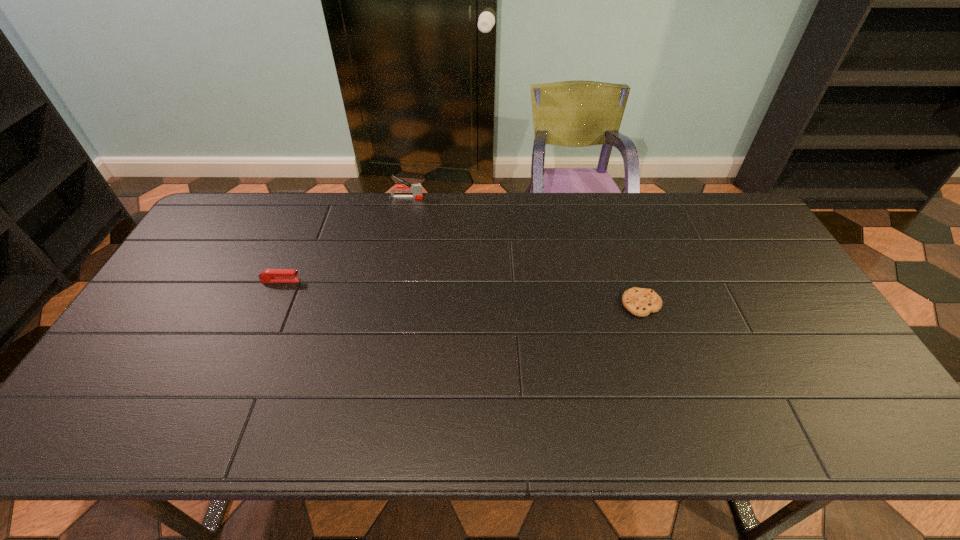
Image resolution: width=960 pixels, height=540 pixels. In order to click on vacant space that satisfies the following two spatial constraints: 1. on the handle side of the cookie; 2. on the left side of the right stapler in this screenshot , I will do `click(385, 305)`.

Image resolution: width=960 pixels, height=540 pixels. What are the coordinates of `vacant space that satisfies the following two spatial constraints: 1. on the back side of the rightmost object; 2. on the front-facing side of the second nearest object` in the screenshot? It's located at (634, 281).

The width and height of the screenshot is (960, 540). I want to click on vacant point that satisfies the following two spatial constraints: 1. on the front-facing side of the cookie; 2. on the left side of the leftmost object, so coord(271,305).

Image resolution: width=960 pixels, height=540 pixels. Find the location of `free space that satisfies the following two spatial constraints: 1. on the front-facing side of the leftmost object; 2. on the right side of the cookie`. free space that satisfies the following two spatial constraints: 1. on the front-facing side of the leftmost object; 2. on the right side of the cookie is located at coordinates (271, 305).

At what (x,y) coordinates should I click in order to perform the action: click on vacant point that satisfies the following two spatial constraints: 1. on the handle side of the cookie; 2. on the right side of the second object from right to left. Please return your answer as a coordinate pair (x, y). Looking at the image, I should click on (385, 305).

This screenshot has height=540, width=960. Identify the location of free space that satisfies the following two spatial constraints: 1. on the handle side of the right stapler; 2. on the right side of the nearest object. (385, 305).

This screenshot has width=960, height=540. Find the location of `free space that satisfies the following two spatial constraints: 1. on the handle side of the taller stapler; 2. on the right side of the shortest object`. free space that satisfies the following two spatial constraints: 1. on the handle side of the taller stapler; 2. on the right side of the shortest object is located at coordinates (385, 305).

You are a GUI agent. You are given a task and a screenshot of the screen. Output one action in this format:
    pyautogui.click(x=<x>, y=<y>)
    Task: Click on the free location that satisfies the following two spatial constraints: 1. on the front-facing side of the nearer stapler; 2. on the back side of the nearest object
    The height and width of the screenshot is (540, 960).
    Given the screenshot: What is the action you would take?
    pyautogui.click(x=271, y=305)